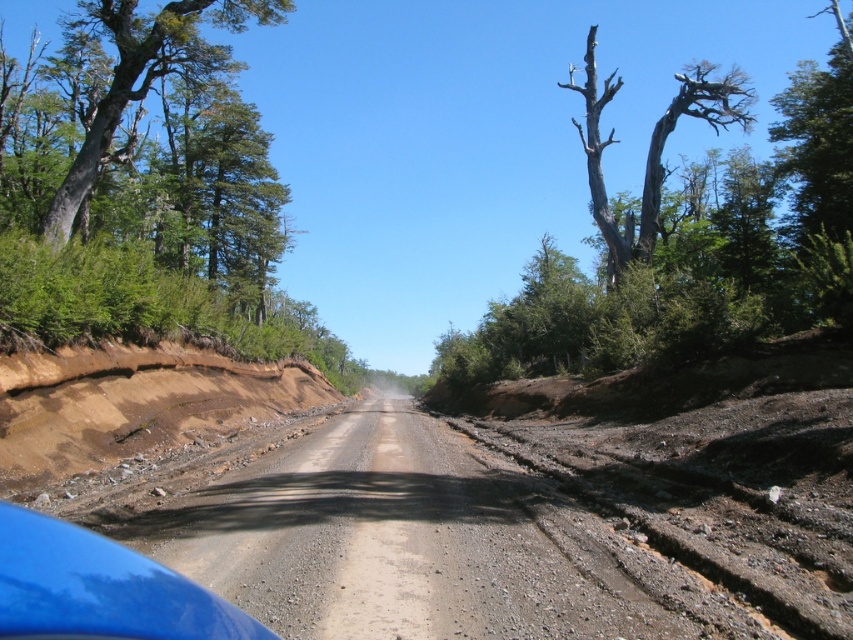
You are driving a car and see the green leafy tree at left and the bare wood tree at upper right. Which tree would appear larger in your view?

The green leafy tree at left is closer to the viewer than the bare wood tree at upper right, so it would appear larger in your view.

You are driving a blue glossy car at lower left and want to park it under a tree for shade. Is the green leafy tree at left a suitable option based on its height compared to the car?

The green leafy tree at left is much taller than the blue glossy car at lower left, so it would provide sufficient shade for the car.

You are driving a car and see the green leafy tree at left and the blue glossy car at lower left in your view. Which object is closer to the left edge of your view?

The green leafy tree at left is positioned on the left side of the blue glossy car at lower left, so the green leafy tree at left is closer to the left edge of your view.